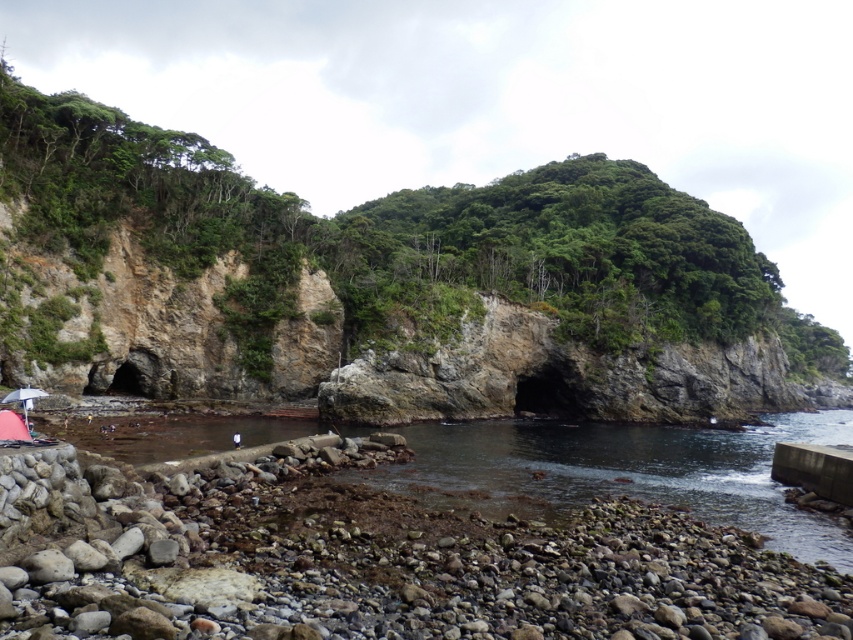
Question: Considering the real-world distances, which object is closest to the transparent plastic umbrella at lower left?

Choices:
 (A) clear water at lower center
 (B) rocky cliff at center

Answer: (A)

Question: Which point is farther to the camera?

Choices:
 (A) (589, 257)
 (B) (467, 506)
 (C) (27, 396)

Answer: (A)

Question: Does clear water at lower center appear on the right side of transparent plastic umbrella at lower left?

Choices:
 (A) no
 (B) yes

Answer: (B)

Question: Does rocky cliff at center have a greater width compared to clear water at lower center?

Choices:
 (A) no
 (B) yes

Answer: (B)

Question: Is rocky cliff at center to the right of transparent plastic umbrella at lower left from the viewer's perspective?

Choices:
 (A) no
 (B) yes

Answer: (B)

Question: Among these objects, which one is farthest from the camera?

Choices:
 (A) clear water at lower center
 (B) transparent plastic umbrella at lower left
 (C) rocky cliff at center

Answer: (C)